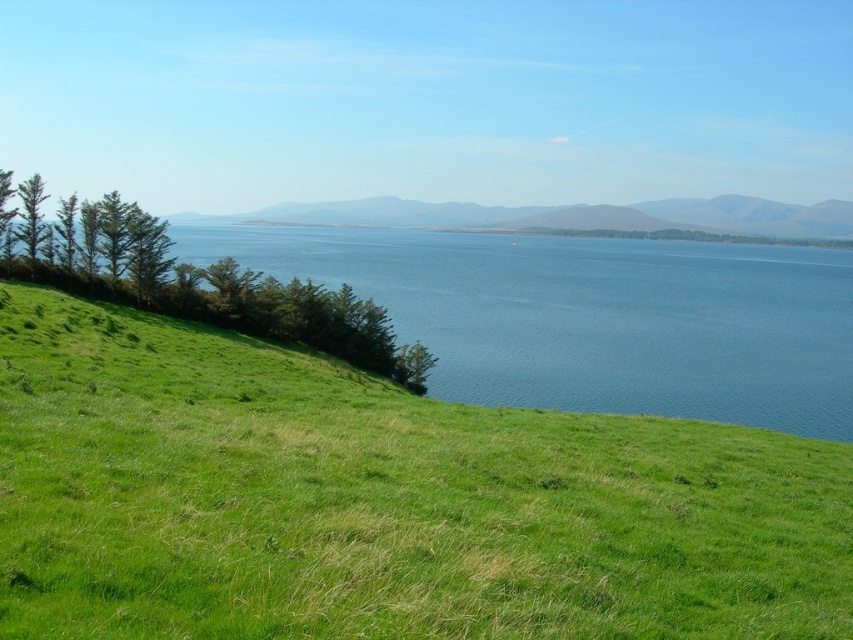
You are standing at the point with coordinates point (741, 486) and want to walk towards the point with coordinates point (314, 230). Which direction should you face to walk directly towards it?

To walk directly from point (741, 486) to point (314, 230), you should face north west because point (741, 486) is in front of point (314, 230).

You are standing on the green grassy hillside at lower left and want to reach the blue water at left. Which direction should you walk to get there?

You should walk towards the left because the blue water at left is located to the left of the green grassy hillside at lower left.